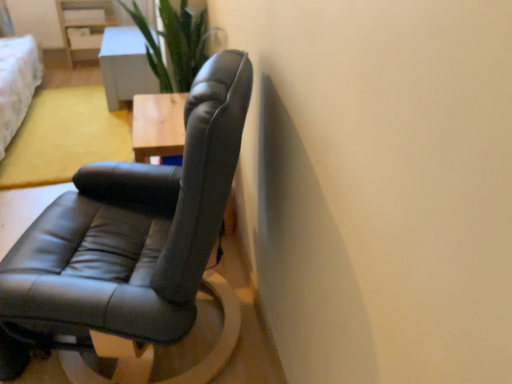
Question: Is light gray wooden table at upper center wider than black leather chair at center?

Choices:
 (A) yes
 (B) no

Answer: (B)

Question: From the image's perspective, is light gray wooden table at upper center under black leather chair at center?

Choices:
 (A) yes
 (B) no

Answer: (B)

Question: Can you confirm if light gray wooden table at upper center is positioned to the left of black leather chair at center?

Choices:
 (A) yes
 (B) no

Answer: (A)

Question: Is light gray wooden table at upper center smaller than black leather chair at center?

Choices:
 (A) yes
 (B) no

Answer: (A)

Question: Would you say light gray wooden table at upper center is outside black leather chair at center?

Choices:
 (A) no
 (B) yes

Answer: (B)

Question: Considering the relative sizes of light gray wooden table at upper center and black leather chair at center in the image provided, is light gray wooden table at upper center bigger than black leather chair at center?

Choices:
 (A) no
 (B) yes

Answer: (A)

Question: Does black leather chair at center have a smaller size compared to light gray wooden table at upper center?

Choices:
 (A) no
 (B) yes

Answer: (A)

Question: Considering the relative sizes of black leather chair at center and light gray wooden table at upper center in the image provided, is black leather chair at center bigger than light gray wooden table at upper center?

Choices:
 (A) no
 (B) yes

Answer: (B)

Question: From the image's perspective, is black leather chair at center on light gray wooden table at upper center?

Choices:
 (A) yes
 (B) no

Answer: (B)

Question: Is the depth of black leather chair at center less than that of light gray wooden table at upper center?

Choices:
 (A) yes
 (B) no

Answer: (A)

Question: Is black leather chair at center next to light gray wooden table at upper center?

Choices:
 (A) yes
 (B) no

Answer: (B)

Question: Is black leather chair at center not within light gray wooden table at upper center?

Choices:
 (A) no
 (B) yes

Answer: (B)

Question: Is point click(115, 102) closer or farther from the camera than point click(160, 332)?

Choices:
 (A) farther
 (B) closer

Answer: (A)